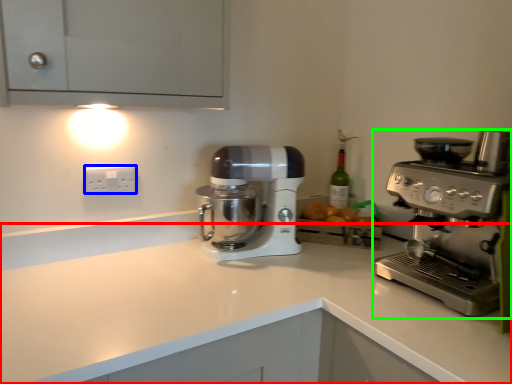
Question: Which object is positioned closest to counter top (highlighted by a red box)? Select from electric outlet (highlighted by a blue box) and coffee maker (highlighted by a green box).

Choices:
 (A) electric outlet
 (B) coffee maker

Answer: (B)